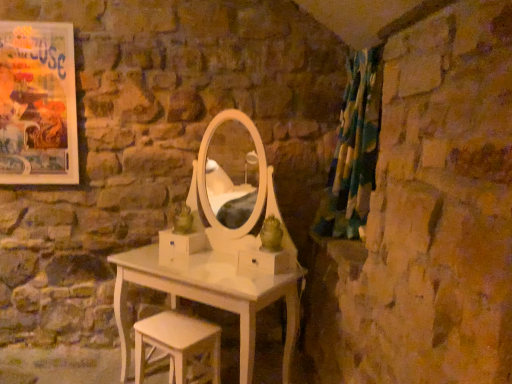
What are the coordinates of `multicolored fabric curtain at right` in the screenshot? It's located at (353, 151).

What is the approximate width of multicolored fabric curtain at right?

multicolored fabric curtain at right is 13.10 inches wide.

What do you see at coordinates (38, 104) in the screenshot?
I see `matte paper poster at upper left` at bounding box center [38, 104].

The width and height of the screenshot is (512, 384). Find the location of `multicolored fabric curtain at right`. multicolored fabric curtain at right is located at coordinates (353, 151).

Which is further, (177, 364) or (375, 69)?

The point (375, 69) is more distant.

Is white wood stool at lower center behind multicolored fabric curtain at right?

No, it is in front of multicolored fabric curtain at right.

Are white wood stool at lower center and multicolored fabric curtain at right located far from each other?

Yes, white wood stool at lower center and multicolored fabric curtain at right are quite far apart.

Based on their sizes in the image, would you say white wood stool at lower center is bigger or smaller than multicolored fabric curtain at right?

Considering their sizes, white wood stool at lower center takes up less space than multicolored fabric curtain at right.

Is white wood stool at lower center oriented towards matte paper poster at upper left?

No, white wood stool at lower center is not turned towards matte paper poster at upper left.

Considering the relative sizes of white wood stool at lower center and matte paper poster at upper left in the image provided, is white wood stool at lower center taller than matte paper poster at upper left?

Incorrect, the height of white wood stool at lower center is not larger of that of matte paper poster at upper left.

From a real-world perspective, which is physically below, white wood stool at lower center or matte paper poster at upper left?

From a 3D spatial view, white wood stool at lower center is below.

From the image's perspective, which is above, matte paper poster at upper left or multicolored fabric curtain at right?

From the image's view, matte paper poster at upper left is above.

Is matte paper poster at upper left positioned far away from multicolored fabric curtain at right?

Indeed, matte paper poster at upper left is not near multicolored fabric curtain at right.

Is the depth of matte paper poster at upper left less than that of multicolored fabric curtain at right?

No, matte paper poster at upper left is further to the viewer.

Which of these two, matte paper poster at upper left or multicolored fabric curtain at right, is smaller?

Smaller between the two is matte paper poster at upper left.

From the picture: Is multicolored fabric curtain at right positioned beyond the bounds of white wood stool at lower center?

multicolored fabric curtain at right is positioned outside white wood stool at lower center.

Which is more to the right, multicolored fabric curtain at right or white wood stool at lower center?

multicolored fabric curtain at right is more to the right.

Looking at this image, is multicolored fabric curtain at right far from white wood stool at lower center?

Yes, multicolored fabric curtain at right and white wood stool at lower center are quite far apart.

Can you tell me how much multicolored fabric curtain at right and white wood stool at lower center differ in facing direction?

48.5 degrees separate the facing orientations of multicolored fabric curtain at right and white wood stool at lower center.

From a real-world perspective, does multicolored fabric curtain at right stand above matte paper poster at upper left?

Actually, multicolored fabric curtain at right is physically below matte paper poster at upper left in the real world.

Considering the sizes of objects multicolored fabric curtain at right and matte paper poster at upper left in the image provided, who is bigger, multicolored fabric curtain at right or matte paper poster at upper left?

multicolored fabric curtain at right.

Which is in front, point (352, 164) or point (39, 158)?

Point (352, 164)

In terms of width, does multicolored fabric curtain at right look wider or thinner when compared to matte paper poster at upper left?

In the image, multicolored fabric curtain at right appears to be wider than matte paper poster at upper left.

Who is more distant, matte paper poster at upper left or white wood stool at lower center?

matte paper poster at upper left.

How different are the orientations of matte paper poster at upper left and white wood stool at lower center in degrees?

The angular difference between matte paper poster at upper left and white wood stool at lower center is 41 degrees.

Considering the positions of objects matte paper poster at upper left and white wood stool at lower center in the image provided, who is more to the right, matte paper poster at upper left or white wood stool at lower center?

Positioned to the right is white wood stool at lower center.

Looking at their sizes, would you say matte paper poster at upper left is wider or thinner than white wood stool at lower center?

matte paper poster at upper left is thinner than white wood stool at lower center.

Locate an element on the screen. Image resolution: width=512 pixels, height=384 pixels. curtain on the right of white wood stool at lower center is located at coordinates (353, 151).

Locate an element on the screen. The height and width of the screenshot is (384, 512). stool located below the matte paper poster at upper left (from the image's perspective) is located at coordinates click(177, 343).

From the image, which object appears to be farther from multicolored fabric curtain at right, matte paper poster at upper left or white wood stool at lower center?

matte paper poster at upper left lies further to multicolored fabric curtain at right than the other object.

Looking at this image, estimate the real-world distances between objects in this image. Which object is closer to matte paper poster at upper left, multicolored fabric curtain at right or white wood stool at lower center?

white wood stool at lower center is positioned closer to the anchor matte paper poster at upper left.

Looking at the image, which one is located closer to multicolored fabric curtain at right, white wood stool at lower center or matte paper poster at upper left?

white wood stool at lower center is positioned closer to the anchor multicolored fabric curtain at right.

Based on their spatial positions, is white wood stool at lower center or multicolored fabric curtain at right closer to matte paper poster at upper left?

Among the two, white wood stool at lower center is located nearer to matte paper poster at upper left.

Estimate the real-world distances between objects in this image. Which object is closer to white wood stool at lower center, multicolored fabric curtain at right or matte paper poster at upper left?

Among the two, multicolored fabric curtain at right is located nearer to white wood stool at lower center.

Estimate the real-world distances between objects in this image. Which object is closer to white wood stool at lower center, matte paper poster at upper left or multicolored fabric curtain at right?

multicolored fabric curtain at right is positioned closer to the anchor white wood stool at lower center.

What are the coordinates of `stool situated between matte paper poster at upper left and multicolored fabric curtain at right from left to right` in the screenshot? It's located at (177, 343).